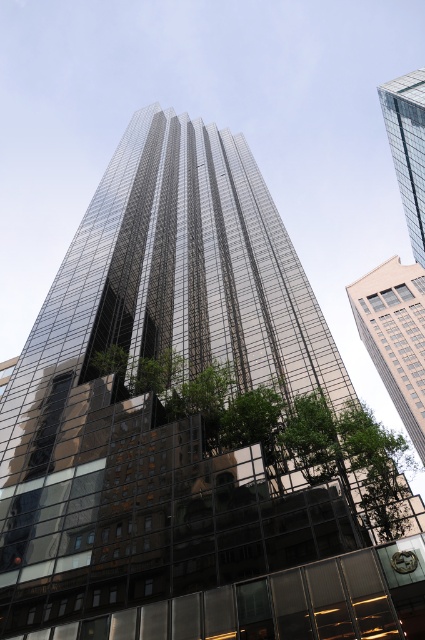
Consider the image. What is the spatial relationship between the beige glass building at right and the glassy reflective skyscraper at upper right from the observer perspective?

The beige glass building at right is closer to the observer than the glassy reflective skyscraper at upper right because it is positioned further to the viewer.

You are standing at the base of the modern skyscraper and want to take a photo of the green leafy tree at center. Where should you position yourself to capture it in the reflection of the skyscraper?

To capture the green leafy tree at center in the reflection of the skyscraper, position yourself at point (277, 432), as that is where the tree is located according to the coordinates provided.

You are standing in front of the beige glass building at right and want to take a photo of the green leafy tree at center. Will the tree be fully visible in the reflection of the building?

The green leafy tree at center is shorter than the beige glass building at right, so the tree will be fully visible in the reflection of the building since its height is less than the building.